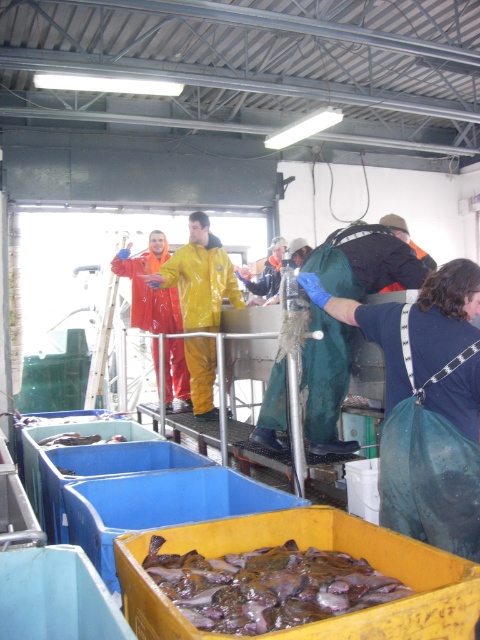
You are a new worker in the processing facility and need to reach both the point at coordinates point (180, 289) and point (153, 321). Which point should you go to first if you want to reach the one closer to you first?

You should go to point (180, 289) first because it is closer to you than point (153, 321).

You are an inspector visiting the seafood processing facility. You notice two workers wearing the green waterproof suit at center and the orange waterproof suit at center. Which worker is wearing a suit that is narrower in width?

The green waterproof suit at center is thinner than the orange waterproof suit at center, so the worker wearing the green waterproof suit at center has a narrower suit.

You are an inspector visiting the seafood processing facility. You notice two workers wearing green waterproof suit at center and orange waterproof suit at center. Which worker is wearing a smaller waterproof suit?

The green waterproof suit at center is smaller than the orange waterproof suit at center, so the worker in the green waterproof suit at center is wearing the smaller one.